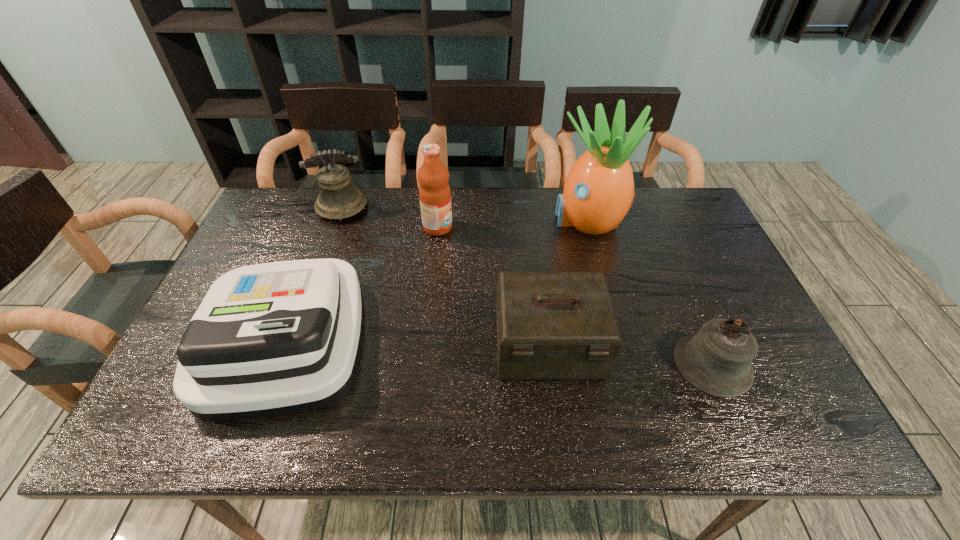
Find the location of a particular element. Image resolution: width=960 pixels, height=540 pixels. object present at the near edge is located at coordinates (271, 339).

I want to click on bell present at the left edge, so click(338, 199).

You are a GUI agent. You are given a task and a screenshot of the screen. Output one action in this format:
    pyautogui.click(x=<x>, y=<y>)
    Task: Click on the cash register positioned at the left edge
    
    Given the screenshot: What is the action you would take?
    point(271,339)

What are the coordinates of `object that is at the right edge` in the screenshot? It's located at (717, 360).

The height and width of the screenshot is (540, 960). What are the coordinates of `object at the far left corner` in the screenshot? It's located at (338, 199).

Locate an element on the screen. The height and width of the screenshot is (540, 960). object present at the near left corner is located at coordinates (271, 339).

Image resolution: width=960 pixels, height=540 pixels. In the image, there is a desktop. Identify the location of vacant space at the far edge. (500, 196).

At what (x,y) coordinates should I click in order to perform the action: click on vacant space at the near edge of the desktop. Please return your answer as a coordinate pair (x, y). The height and width of the screenshot is (540, 960). Looking at the image, I should click on (409, 414).

Where is `vacant area at the left edge of the desktop`? vacant area at the left edge of the desktop is located at coordinates (242, 261).

The height and width of the screenshot is (540, 960). In the image, there is a desktop. What are the coordinates of `vacant space at the right edge` in the screenshot? It's located at (756, 328).